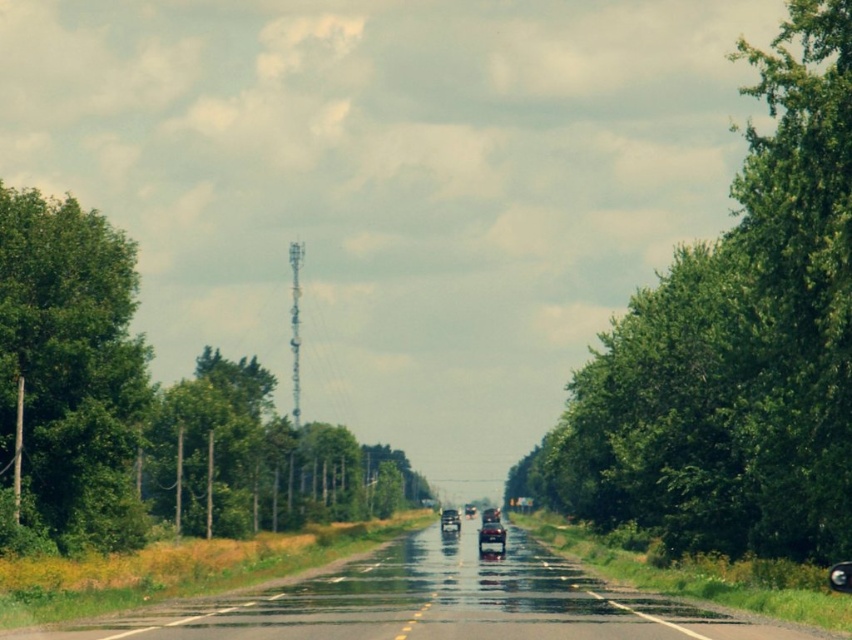
Question: Is green leafy tree at center closer to camera compared to shiny silver car at center?

Choices:
 (A) no
 (B) yes

Answer: (B)

Question: Considering the real-world distances, which object is farthest from the green leafy tree at center?

Choices:
 (A) green leafy tree at right
 (B) shiny silver sedan at center
 (C) green leafy tree at left

Answer: (B)

Question: Which of the following is the closest to the observer?

Choices:
 (A) green leafy tree at center
 (B) shiny silver sedan at center

Answer: (A)

Question: Can you confirm if green leafy tree at right is positioned to the left of shiny silver car at center?

Choices:
 (A) no
 (B) yes

Answer: (A)

Question: Which of the following is the farthest from the observer?

Choices:
 (A) green leafy tree at left
 (B) green leafy tree at right
 (C) shiny silver sedan at center

Answer: (C)

Question: Does green leafy tree at left have a smaller size compared to wet asphalt road at center?

Choices:
 (A) yes
 (B) no

Answer: (A)